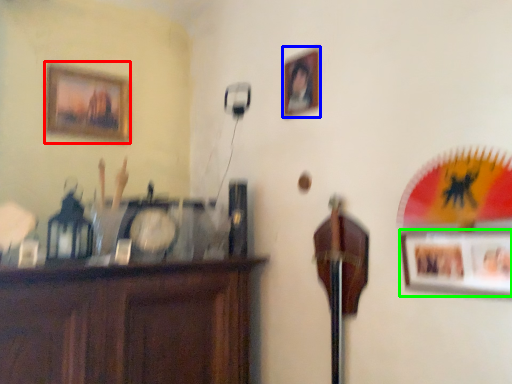
Question: Based on their relative distances, which object is farther from picture frame (highlighted by a red box)? Choose from picture frame (highlighted by a blue box) and picture frame (highlighted by a green box).

Choices:
 (A) picture frame
 (B) picture frame

Answer: (B)